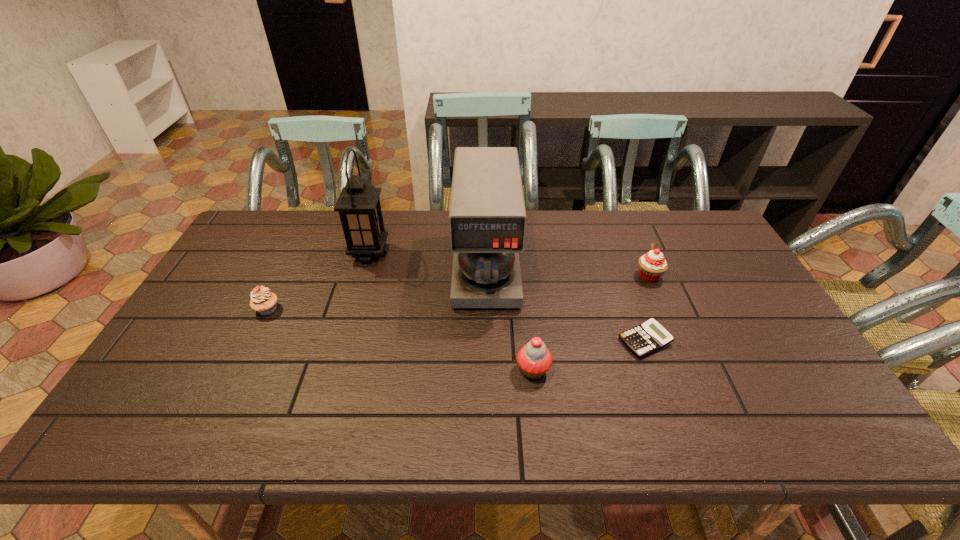
Find the location of a particular element. the fifth object from right to left is located at coordinates 359,208.

The image size is (960, 540). Identify the location of coffee maker. (487, 216).

The image size is (960, 540). In order to click on the farthest cupcake in this screenshot , I will do `click(652, 265)`.

You are a GUI agent. You are given a task and a screenshot of the screen. Output one action in this format:
    pyautogui.click(x=<x>, y=<y>)
    Task: Click on the second cupcake from left to right
    Image resolution: width=960 pixels, height=540 pixels.
    Given the screenshot: What is the action you would take?
    pyautogui.click(x=534, y=359)

You are a GUI agent. You are given a task and a screenshot of the screen. Output one action in this format:
    pyautogui.click(x=<x>, y=<y>)
    Task: Click on the leftmost cupcake
    This screenshot has height=540, width=960.
    Given the screenshot: What is the action you would take?
    pyautogui.click(x=263, y=301)

What are the coordinates of `the shortest cupcake` in the screenshot? It's located at (263, 301).

Where is `calculator`? Image resolution: width=960 pixels, height=540 pixels. calculator is located at coordinates (650, 336).

Find the location of a particular element. vacant space situated on the front of the second object from left to right is located at coordinates (352, 312).

Where is `free region located 0.370m on the carafe side of the coffee maker`? This screenshot has width=960, height=540. free region located 0.370m on the carafe side of the coffee maker is located at coordinates (489, 432).

The height and width of the screenshot is (540, 960). What are the coordinates of `free space located on the back of the rightmost cupcake` in the screenshot? It's located at (622, 214).